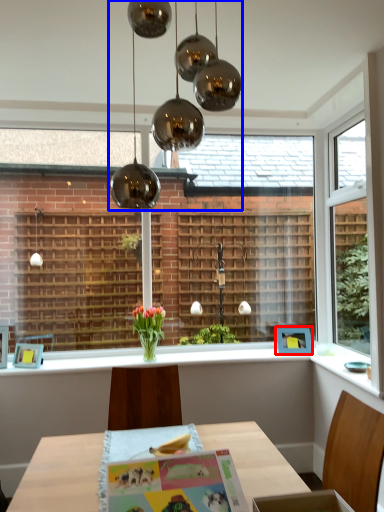
Question: Which of the following is the closest to the observer, picture frame (highlighted by a red box) or chandelier (highlighted by a blue box)?

Choices:
 (A) picture frame
 (B) chandelier

Answer: (B)